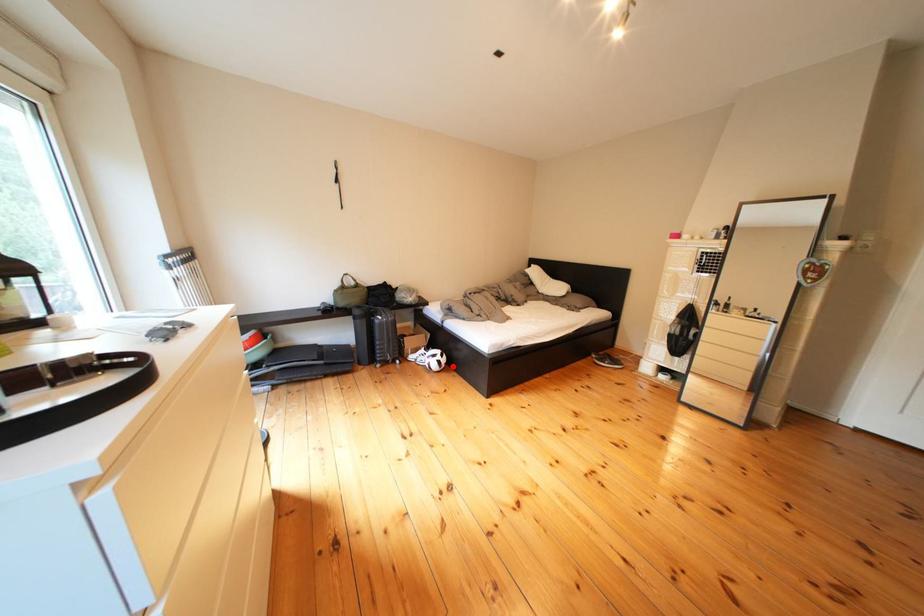
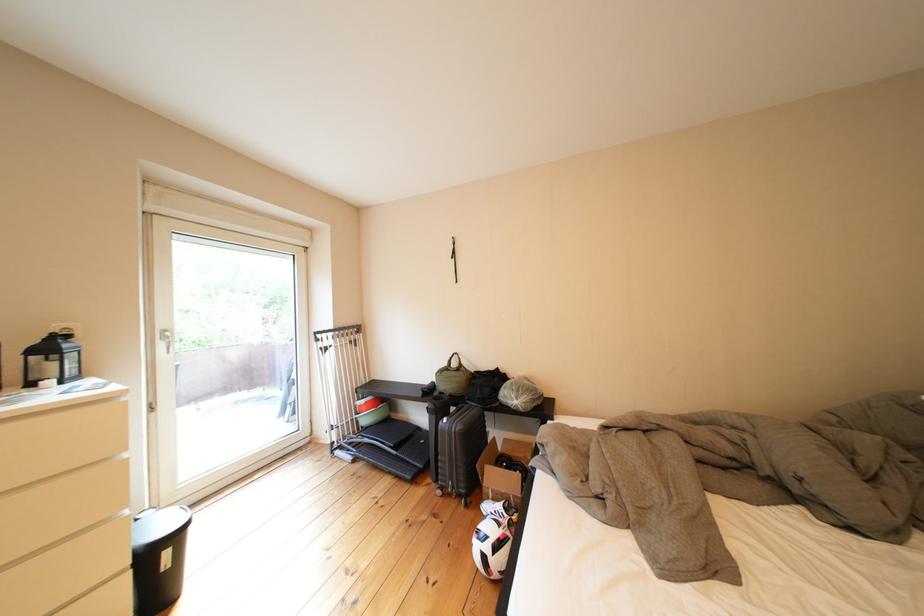
Question: A red point is marked in image1. In image2, is the corresponding 3D point closer to the camera or farther? Reply with the corresponding letter.

Choices:
 (A) The corresponding 3D point is closer.
 (B) The corresponding 3D point is farther.

Answer: (A)